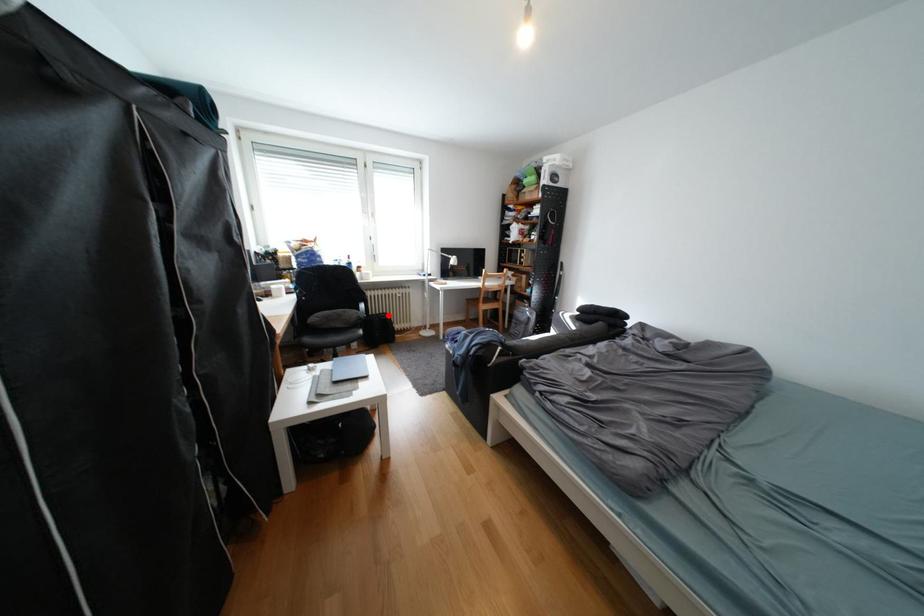
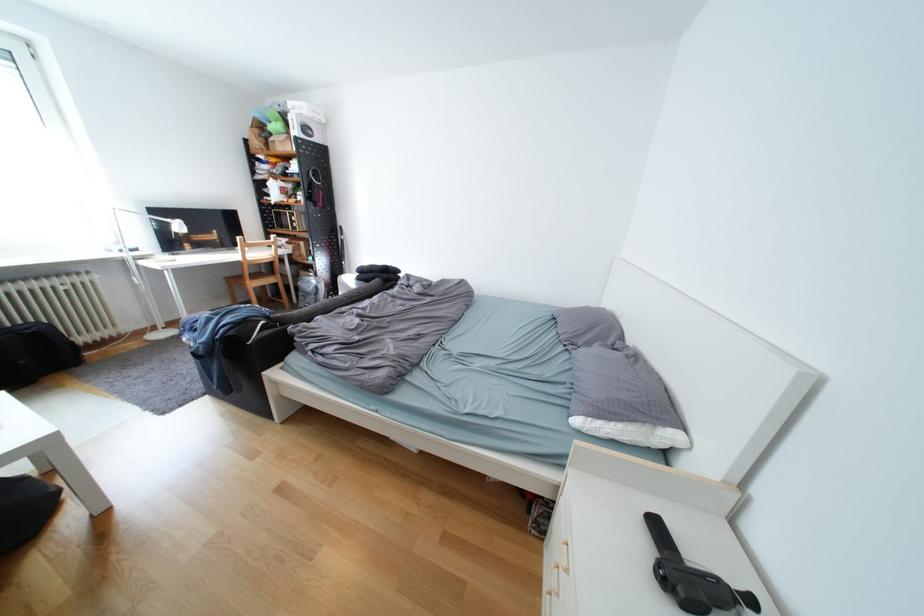
Question: I am providing you with two images of the same scene from different viewpoints. Given a red point in image1, look at the same physical point in image2. Is it:

Choices:
 (A) Closer to the viewpoint
 (B) Farther from the viewpoint

Answer: (B)